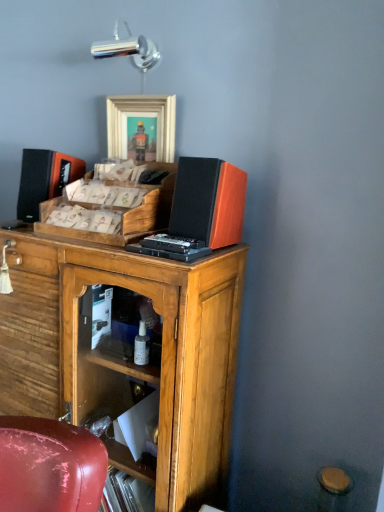
Question: Can you confirm if orange matte speaker at upper right is bigger than wooden tray at center?

Choices:
 (A) no
 (B) yes

Answer: (A)

Question: Could you tell me if orange matte speaker at upper right is facing wooden tray at center?

Choices:
 (A) yes
 (B) no

Answer: (B)

Question: Is wooden tray at center a part of orange matte speaker at upper right?

Choices:
 (A) no
 (B) yes

Answer: (A)

Question: Is orange matte speaker at upper right directly adjacent to wooden tray at center?

Choices:
 (A) yes
 (B) no

Answer: (B)

Question: From a real-world perspective, is orange matte speaker at upper right physically below wooden tray at center?

Choices:
 (A) no
 (B) yes

Answer: (A)

Question: Is orange matte speaker at upper right looking in the opposite direction of wooden tray at center?

Choices:
 (A) no
 (B) yes

Answer: (A)

Question: Is matte black speaker at upper left with orange matte speaker at upper right?

Choices:
 (A) no
 (B) yes

Answer: (A)

Question: Is matte black speaker at upper left taller than orange matte speaker at upper right?

Choices:
 (A) yes
 (B) no

Answer: (A)

Question: Is matte black speaker at upper left smaller than orange matte speaker at upper right?

Choices:
 (A) yes
 (B) no

Answer: (B)

Question: From the image's perspective, would you say matte black speaker at upper left is positioned over orange matte speaker at upper right?

Choices:
 (A) yes
 (B) no

Answer: (A)

Question: Is matte black speaker at upper left far away from orange matte speaker at upper right?

Choices:
 (A) no
 (B) yes

Answer: (A)

Question: Does matte black speaker at upper left have a larger size compared to orange matte speaker at upper right?

Choices:
 (A) yes
 (B) no

Answer: (A)

Question: Does wooden cabinet at center have a greater width compared to wooden tray at center?

Choices:
 (A) yes
 (B) no

Answer: (A)